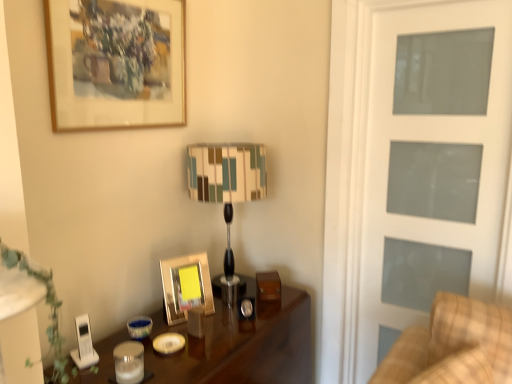
Question: Considering the relative positions of shiny dark wood table at center and plaid fabric couch at right in the image provided, is shiny dark wood table at center to the right of plaid fabric couch at right from the viewer's perspective?

Choices:
 (A) no
 (B) yes

Answer: (A)

Question: Is shiny dark wood table at center wider than plaid fabric couch at right?

Choices:
 (A) no
 (B) yes

Answer: (B)

Question: Would you say shiny dark wood table at center contains plaid fabric couch at right?

Choices:
 (A) no
 (B) yes

Answer: (A)

Question: Considering the relative positions of shiny dark wood table at center and plaid fabric couch at right in the image provided, is shiny dark wood table at center behind plaid fabric couch at right?

Choices:
 (A) no
 (B) yes

Answer: (B)

Question: Is shiny dark wood table at center looking in the opposite direction of plaid fabric couch at right?

Choices:
 (A) no
 (B) yes

Answer: (A)

Question: Does shiny dark wood table at center touch plaid fabric couch at right?

Choices:
 (A) yes
 (B) no

Answer: (B)

Question: Is green leafy plant at lower left to the left of striped fabric lampshade at center from the viewer's perspective?

Choices:
 (A) yes
 (B) no

Answer: (A)

Question: Can you confirm if green leafy plant at lower left is wider than striped fabric lampshade at center?

Choices:
 (A) no
 (B) yes

Answer: (A)

Question: From a real-world perspective, is green leafy plant at lower left over striped fabric lampshade at center?

Choices:
 (A) no
 (B) yes

Answer: (B)

Question: Is the depth of green leafy plant at lower left greater than that of striped fabric lampshade at center?

Choices:
 (A) yes
 (B) no

Answer: (B)

Question: Would you say green leafy plant at lower left is a long distance from striped fabric lampshade at center?

Choices:
 (A) yes
 (B) no

Answer: (B)

Question: Are green leafy plant at lower left and striped fabric lampshade at center making contact?

Choices:
 (A) yes
 (B) no

Answer: (B)

Question: Can you confirm if striped fabric lampshade at center is positioned to the left of gold metallic picture frame at center, which ranks as the 2th picture frame in top-to-bottom order?

Choices:
 (A) no
 (B) yes

Answer: (A)